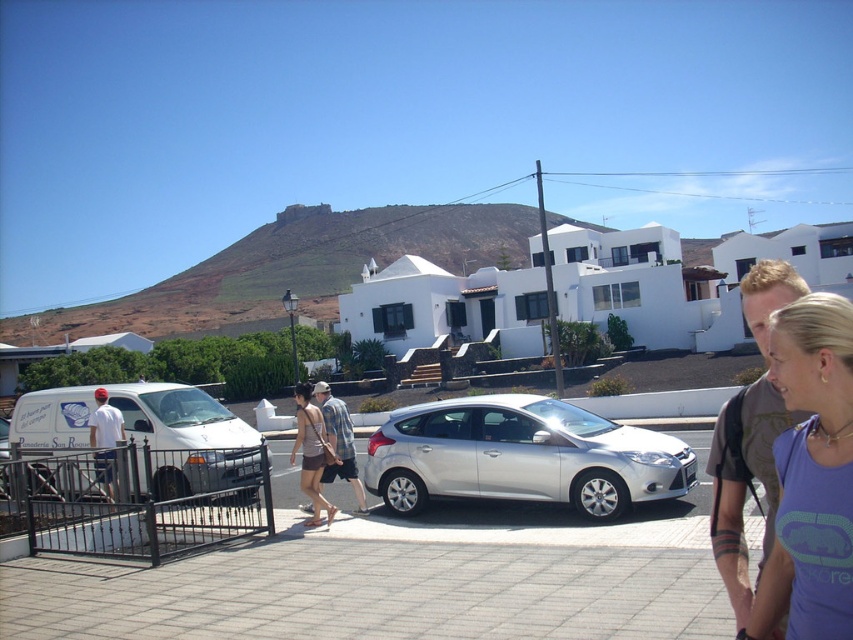
Who is shorter, silver metallic hatchback at center or matte brown shorts at center?

silver metallic hatchback at center is shorter.

Is silver metallic hatchback at center closer to the viewer compared to matte brown shorts at center?

Yes, it is in front of matte brown shorts at center.

Does point (612, 451) come closer to viewer compared to point (334, 458)?

Yes, point (612, 451) is in front of point (334, 458).

Locate an element on the screen. The image size is (853, 640). silver metallic hatchback at center is located at coordinates (521, 456).

Is silver metallic hatchback at center closer to the viewer compared to purple cotton tank top at lower right?

No.

Is silver metallic hatchback at center taller than purple cotton tank top at lower right?

In fact, silver metallic hatchback at center may be shorter than purple cotton tank top at lower right.

Find the location of `silver metallic hatchback at center`. silver metallic hatchback at center is located at coordinates (521, 456).

Describe the element at coordinates (521, 456) in the screenshot. The image size is (853, 640). I see `silver metallic hatchback at center` at that location.

Does point (460, 403) come closer to viewer compared to point (94, 436)?

Yes, point (460, 403) is in front of point (94, 436).

Which is behind, point (440, 448) or point (108, 422)?

Positioned behind is point (108, 422).

The image size is (853, 640). What are the coordinates of `silver metallic hatchback at center` in the screenshot? It's located at (521, 456).